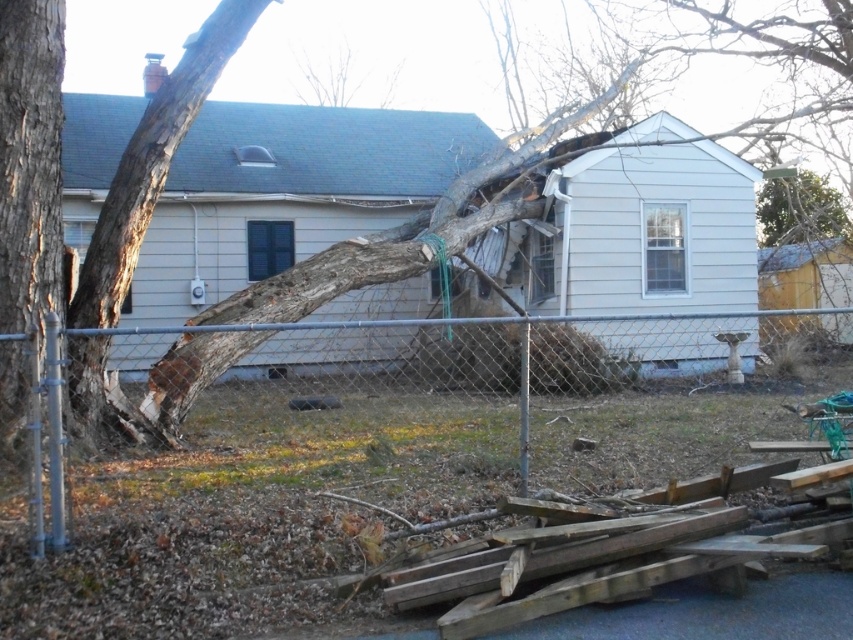
Question: Among these points, which one is nearest to the camera?

Choices:
 (A) (3, 67)
 (B) (579, 408)

Answer: (A)

Question: Is metallic chain-link fence at center to the left of smooth brown bark at left from the viewer's perspective?

Choices:
 (A) no
 (B) yes

Answer: (A)

Question: Can you confirm if metallic chain-link fence at center is bigger than smooth brown bark at left?

Choices:
 (A) no
 (B) yes

Answer: (B)

Question: Among these points, which one is nearest to the camera?

Choices:
 (A) (21, 216)
 (B) (572, 442)

Answer: (A)

Question: Can you confirm if metallic chain-link fence at center is positioned to the right of smooth brown bark at left?

Choices:
 (A) no
 (B) yes

Answer: (B)

Question: Which object appears farthest from the camera in this image?

Choices:
 (A) metallic chain-link fence at center
 (B) smooth brown bark at left

Answer: (B)